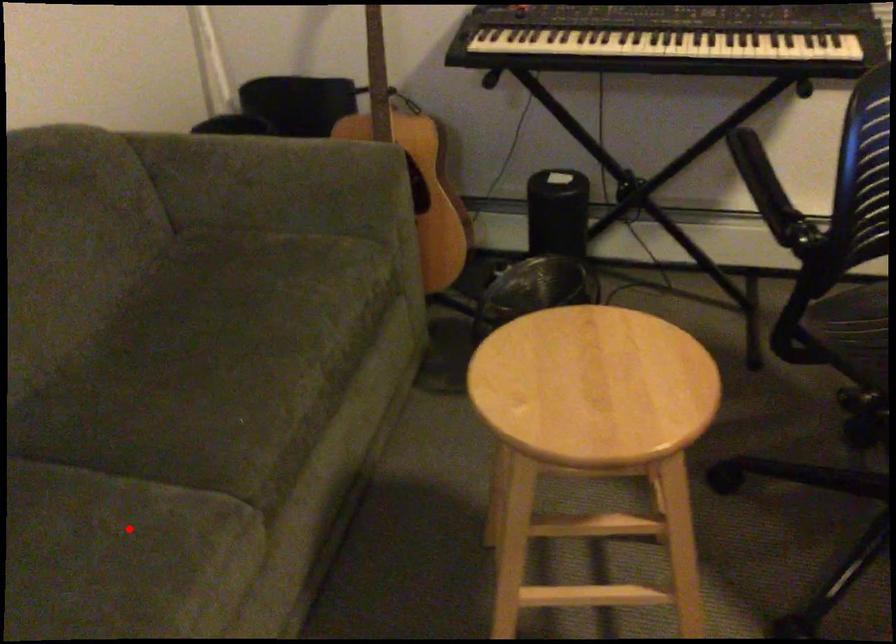
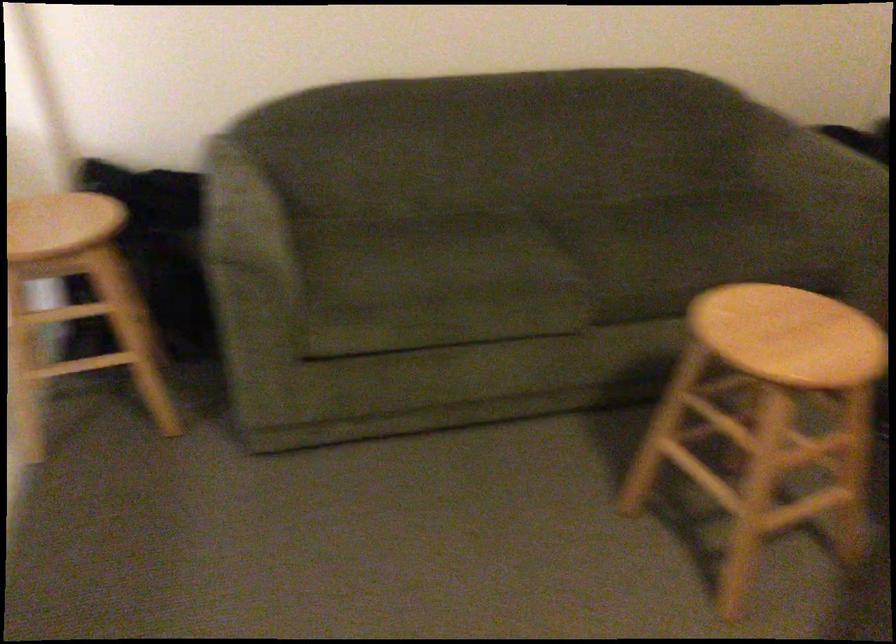
The point at the highlighted location is marked in the first image. Where is the corresponding point in the second image?

(530, 261)